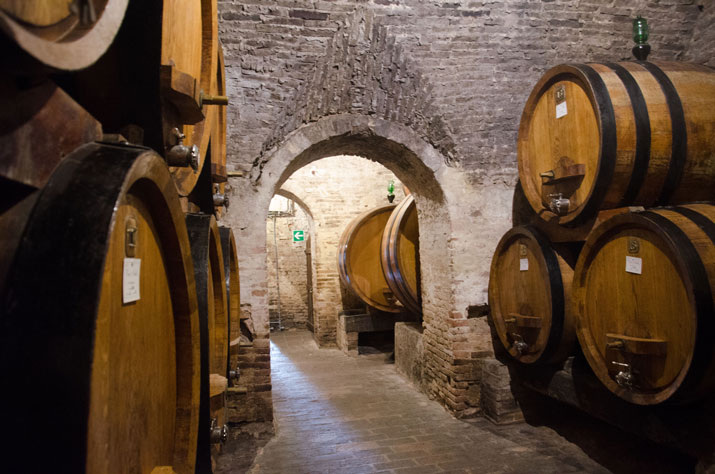
At what (x,y) coordinates should I click in order to perform the action: click on window. Please return your answer as a coordinate pair (x, y). Image resolution: width=715 pixels, height=474 pixels. Looking at the image, I should click on (277, 201).